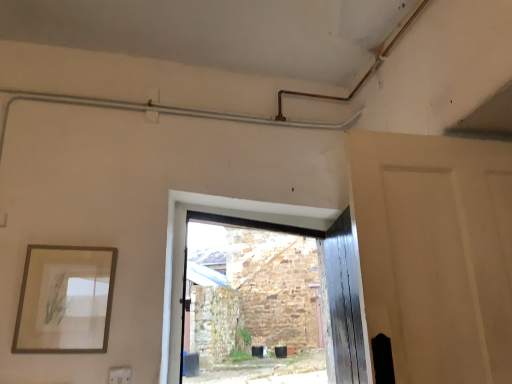
The height and width of the screenshot is (384, 512). What do you see at coordinates (436, 253) in the screenshot?
I see `matte white door at right` at bounding box center [436, 253].

The width and height of the screenshot is (512, 384). I want to click on wooden picture frame at left, so click(x=65, y=300).

From a real-world perspective, is matte white door at right on top of white plastic electric outlet at lower left?

Correct, in the physical world, matte white door at right is higher than white plastic electric outlet at lower left.

In the scene shown: Which is more to the left, matte white door at right or white plastic electric outlet at lower left?

white plastic electric outlet at lower left is more to the left.

Does matte white door at right contain white plastic electric outlet at lower left?

Actually, white plastic electric outlet at lower left is outside matte white door at right.

Is there a large distance between matte white door at right and white plastic electric outlet at lower left?

Yes, matte white door at right and white plastic electric outlet at lower left are quite far apart.

Is wooden picture frame at left further to camera compared to matte white door at right?

Yes, wooden picture frame at left is further from the viewer.

Is wooden picture frame at left not inside matte white door at right?

Absolutely, wooden picture frame at left is external to matte white door at right.

Between wooden picture frame at left and matte white door at right, which one has smaller size?

Smaller between the two is wooden picture frame at left.

Which is behind, point (21, 351) or point (111, 377)?

The point (111, 377) is more distant.

Could you tell me if wooden picture frame at left is turned towards white plastic electric outlet at lower left?

No, wooden picture frame at left is not oriented towards white plastic electric outlet at lower left.

Is wooden picture frame at left not near white plastic electric outlet at lower left?

Actually, wooden picture frame at left and white plastic electric outlet at lower left are a little close together.

Consider the image. Who is smaller, wooden picture frame at left or white plastic electric outlet at lower left?

With smaller size is white plastic electric outlet at lower left.

In the scene shown: Is white plastic electric outlet at lower left inside or outside of matte white door at right?

white plastic electric outlet at lower left exists outside the volume of matte white door at right.

In the scene shown: How distant is white plastic electric outlet at lower left from matte white door at right?

They are 4.29 feet apart.

Where is `door in front of the white plastic electric outlet at lower left`? The height and width of the screenshot is (384, 512). door in front of the white plastic electric outlet at lower left is located at coordinates (436, 253).

In terms of size, does white plastic electric outlet at lower left appear bigger or smaller than matte white door at right?

Clearly, white plastic electric outlet at lower left is smaller in size than matte white door at right.

Would you say matte white door at right is inside or outside wooden picture frame at left?

matte white door at right exists outside the volume of wooden picture frame at left.

Considering the positions of objects matte white door at right and wooden picture frame at left in the image provided, who is more to the left, matte white door at right or wooden picture frame at left?

Positioned to the left is wooden picture frame at left.

Does matte white door at right touch wooden picture frame at left?

matte white door at right is not next to wooden picture frame at left, and they're not touching.

Considering the relative sizes of white plastic electric outlet at lower left and wooden picture frame at left in the image provided, is white plastic electric outlet at lower left shorter than wooden picture frame at left?

Indeed, white plastic electric outlet at lower left has a lesser height compared to wooden picture frame at left.

Considering the positions of point (128, 381) and point (34, 252), is point (128, 381) closer or farther from the camera than point (34, 252)?

Point (128, 381).

From a real-world perspective, which object rests below the other?

white plastic electric outlet at lower left, from a real-world perspective.

Is white plastic electric outlet at lower left positioned with its back to wooden picture frame at left?

No.

Identify the location of electric outlet behind the matte white door at right. Image resolution: width=512 pixels, height=384 pixels. (120, 375).

Where is `door above the wooden picture frame at left (from a real-world perspective)`? The width and height of the screenshot is (512, 384). door above the wooden picture frame at left (from a real-world perspective) is located at coordinates (436, 253).

Looking at this image, which object lies further to the anchor point wooden picture frame at left, matte white door at right or white plastic electric outlet at lower left?

matte white door at right is further to wooden picture frame at left.

From the image, which object appears to be farther from matte white door at right, white plastic electric outlet at lower left or wooden picture frame at left?

The object further to matte white door at right is white plastic electric outlet at lower left.

From the image, which object appears to be nearer to white plastic electric outlet at lower left, wooden picture frame at left or matte white door at right?

Based on the image, wooden picture frame at left appears to be nearer to white plastic electric outlet at lower left.

When comparing their distances from matte white door at right, does wooden picture frame at left or white plastic electric outlet at lower left seem closer?

Among the two, wooden picture frame at left is located nearer to matte white door at right.

Considering their positions, is white plastic electric outlet at lower left positioned further to wooden picture frame at left than matte white door at right?

matte white door at right is further to wooden picture frame at left.

Considering their positions, is matte white door at right positioned closer to white plastic electric outlet at lower left than wooden picture frame at left?

wooden picture frame at left lies closer to white plastic electric outlet at lower left than the other object.

You are a GUI agent. You are given a task and a screenshot of the screen. Output one action in this format:
    pyautogui.click(x=<x>, y=<y>)
    Task: Click on the electric outlet located between wooden picture frame at left and matte white door at right in the left-right direction
    This screenshot has width=512, height=384.
    Given the screenshot: What is the action you would take?
    pyautogui.click(x=120, y=375)